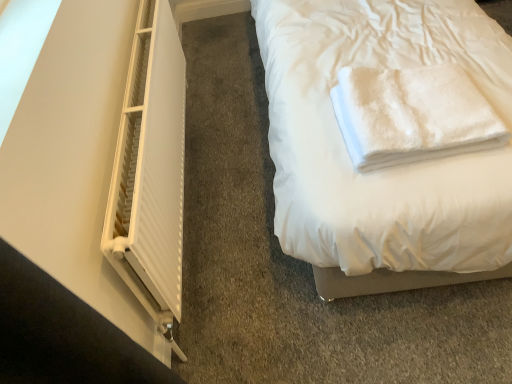
The height and width of the screenshot is (384, 512). What do you see at coordinates (412, 115) in the screenshot?
I see `white fluffy towel at upper right` at bounding box center [412, 115].

Where is `white fluffy towel at upper right`? The image size is (512, 384). white fluffy towel at upper right is located at coordinates pos(412,115).

Image resolution: width=512 pixels, height=384 pixels. What are the coordinates of `white matte radiator at left` in the screenshot? It's located at (150, 167).

Describe the element at coordinates (150, 167) in the screenshot. This screenshot has height=384, width=512. I see `white matte radiator at left` at that location.

Identify the location of white fluffy towel at upper right. This screenshot has height=384, width=512. (412, 115).

Consider the image. Is white fluffy towel at upper right at the right side of white matte radiator at left?

Indeed, white fluffy towel at upper right is positioned on the right side of white matte radiator at left.

Relative to white matte radiator at left, is white fluffy towel at upper right in front or behind?

white fluffy towel at upper right is positioned farther from the viewer than white matte radiator at left.

Considering the positions of points (356, 124) and (176, 305), is point (356, 124) farther from camera compared to point (176, 305)?

No, (356, 124) is closer to viewer.

From the image's perspective, relative to white matte radiator at left, is white fluffy towel at upper right above or below?

From the image's perspective, white fluffy towel at upper right appears above white matte radiator at left.

From a real-world perspective, relative to white matte radiator at left, is white fluffy towel at upper right vertically above or below?

From a real-world perspective, white fluffy towel at upper right is physically above white matte radiator at left.

Can you confirm if white fluffy towel at upper right is wider than white matte radiator at left?

Correct, the width of white fluffy towel at upper right exceeds that of white matte radiator at left.

Considering the relative sizes of white fluffy towel at upper right and white matte radiator at left in the image provided, is white fluffy towel at upper right shorter than white matte radiator at left?

Yes.

Looking at this image, between white fluffy towel at upper right and white matte radiator at left, which one has larger size?

white matte radiator at left is bigger.

Is white fluffy towel at upper right located outside white matte radiator at left?

Absolutely, white fluffy towel at upper right is external to white matte radiator at left.

Is white fluffy towel at upper right not near white matte radiator at left?

No, there isn't a large distance between white fluffy towel at upper right and white matte radiator at left.

Is white fluffy towel at upper right facing towards white matte radiator at left?

No, white fluffy towel at upper right does not turn towards white matte radiator at left.

How different are the orientations of white fluffy towel at upper right and white matte radiator at left in degrees?

The angular difference between white fluffy towel at upper right and white matte radiator at left is 90.7 degrees.

Measure the distance between white fluffy towel at upper right and white matte radiator at left.

29.37 inches.

Where is `window to the left of white fluffy towel at upper right`? Image resolution: width=512 pixels, height=384 pixels. window to the left of white fluffy towel at upper right is located at coordinates (150, 167).

Does white matte radiator at left appear on the right side of white fluffy towel at upper right?

No.

Considering the positions of objects white matte radiator at left and white fluffy towel at upper right in the image provided, who is behind, white matte radiator at left or white fluffy towel at upper right?

white fluffy towel at upper right is more distant.

Is point (103, 235) in front of point (357, 126)?

That is True.

From the image's perspective, is white matte radiator at left on white fluffy towel at upper right?

Incorrect, from the image's perspective, white matte radiator at left is lower than white fluffy towel at upper right.

From a real-world perspective, which is physically below, white matte radiator at left or white fluffy towel at upper right?

From a 3D spatial view, white matte radiator at left is below.

Which of these two, white matte radiator at left or white fluffy towel at upper right, is wider?

With larger width is white fluffy towel at upper right.

Who is taller, white matte radiator at left or white fluffy towel at upper right?

white matte radiator at left is taller.

Between white matte radiator at left and white fluffy towel at upper right, which one has smaller size?

white fluffy towel at upper right.

Is white matte radiator at left outside of white fluffy towel at upper right?

Yes, white matte radiator at left is located beyond the bounds of white fluffy towel at upper right.

Is white matte radiator at left far away from white fluffy towel at upper right?

No.

Consider the image. Is white matte radiator at left oriented away from white fluffy towel at upper right?

white matte radiator at left does not have its back to white fluffy towel at upper right.

At what (x,y) coordinates should I click in order to perform the action: click on window below the white fluffy towel at upper right (from the image's perspective). Please return your answer as a coordinate pair (x, y). The image size is (512, 384). Looking at the image, I should click on (150, 167).

Locate an element on the screen. This screenshot has width=512, height=384. window on the left side of white fluffy towel at upper right is located at coordinates (150, 167).

Locate an element on the screen. window that is under the white fluffy towel at upper right (from a real-world perspective) is located at coordinates (150, 167).